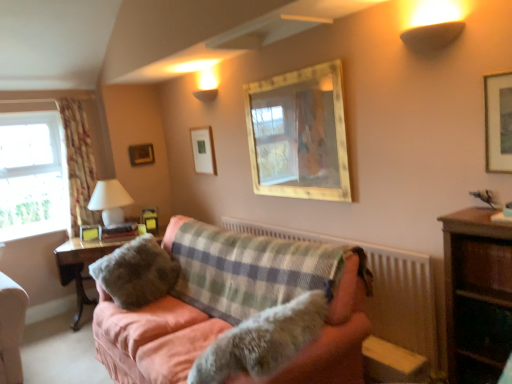
Question: From a real-world perspective, is floral fabric curtain at left under woodenmaterial/texturetable at left, the 1th table positioned from the back?

Choices:
 (A) no
 (B) yes

Answer: (A)

Question: Does floral fabric curtain at left have a larger size compared to woodenmaterial/texturetable at left, the 1th table positioned from the back?

Choices:
 (A) no
 (B) yes

Answer: (A)

Question: Is floral fabric curtain at left outside of woodenmaterial/texturetable at left, the 1th table positioned from the back?

Choices:
 (A) yes
 (B) no

Answer: (A)

Question: From the image's perspective, is floral fabric curtain at left on top of woodenmaterial/texturetable at left, the 1th table positioned from the back?

Choices:
 (A) yes
 (B) no

Answer: (A)

Question: Are floral fabric curtain at left and woodenmaterial/texturetable at left, the 2th table viewed from the right, located far from each other?

Choices:
 (A) no
 (B) yes

Answer: (A)

Question: Does floral fabric curtain at left have a lesser height compared to woodenmaterial/texturetable at left, the 1th table positioned from the back?

Choices:
 (A) yes
 (B) no

Answer: (B)

Question: Is fuzzy fur dog at center oriented towards white glossy table lamp at left?

Choices:
 (A) yes
 (B) no

Answer: (B)

Question: Considering the relative sizes of fuzzy fur dog at center and white glossy table lamp at left in the image provided, is fuzzy fur dog at center smaller than white glossy table lamp at left?

Choices:
 (A) yes
 (B) no

Answer: (B)

Question: Considering the relative positions of fuzzy fur dog at center and white glossy table lamp at left in the image provided, is fuzzy fur dog at center to the right of white glossy table lamp at left from the viewer's perspective?

Choices:
 (A) no
 (B) yes

Answer: (B)

Question: Is fuzzy fur dog at center touching white glossy table lamp at left?

Choices:
 (A) no
 (B) yes

Answer: (A)

Question: Is fuzzy fur dog at center shorter than white glossy table lamp at left?

Choices:
 (A) yes
 (B) no

Answer: (A)

Question: Is fuzzy fur dog at center not near white glossy table lamp at left?

Choices:
 (A) no
 (B) yes

Answer: (B)

Question: Does fuzzy fabric pillow at center have a lesser width compared to clear glass window at left?

Choices:
 (A) no
 (B) yes

Answer: (A)